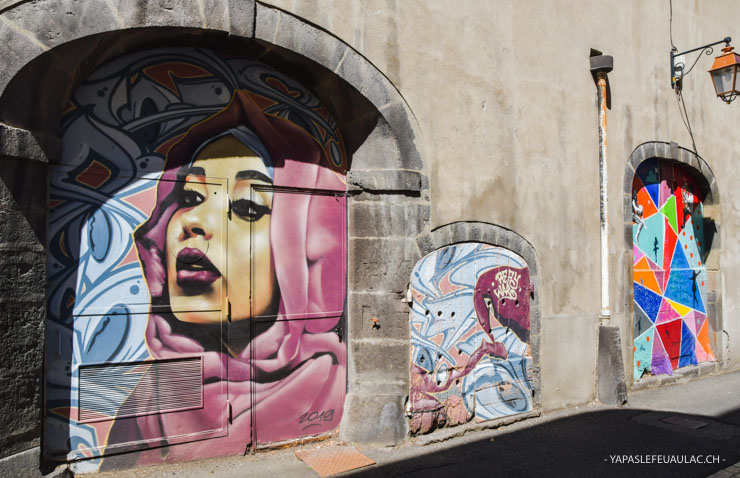
The image size is (740, 478). Find the location of `light`. light is located at coordinates (721, 74).